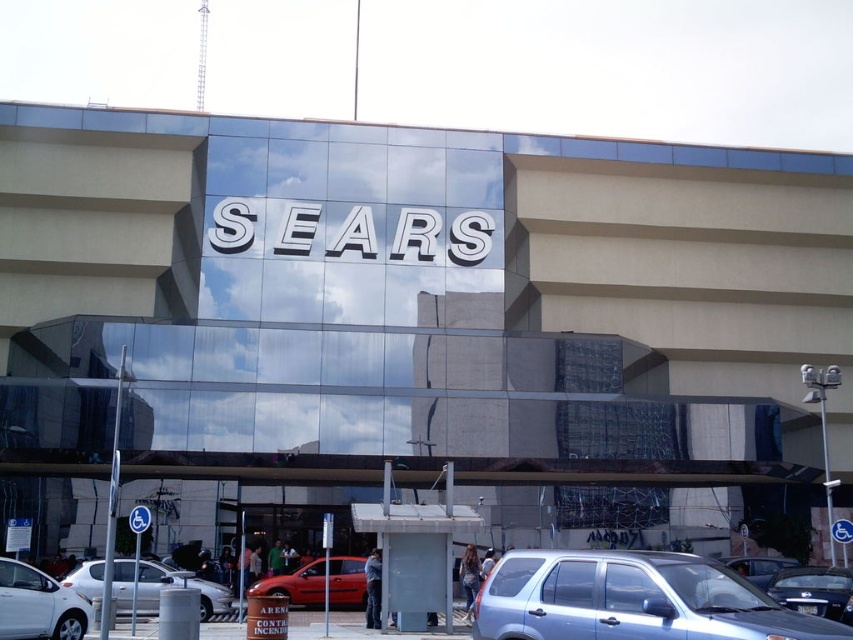
Can you confirm if silver metallic sedan at lower left is shorter than metallic silver sedan at lower right?

No, silver metallic sedan at lower left is not shorter than metallic silver sedan at lower right.

Does silver metallic sedan at lower left have a lesser width compared to metallic silver sedan at lower right?

Incorrect, silver metallic sedan at lower left's width is not less than metallic silver sedan at lower right's.

Who is more distant from viewer, [219,592] or [808,596]?

Point [219,592]

This screenshot has width=853, height=640. Identify the location of silver metallic sedan at lower left. (178, 588).

Can you confirm if white glossy sedan at lower left is bigger than shiny red car at center?

Indeed, white glossy sedan at lower left has a larger size compared to shiny red car at center.

Does white glossy sedan at lower left appear over shiny red car at center?

Indeed, white glossy sedan at lower left is positioned over shiny red car at center.

Where is `white glossy sedan at lower left`? white glossy sedan at lower left is located at coordinates (38, 605).

Which is below, satin blue suv at lower right or metallic silver sedan at lower right?

metallic silver sedan at lower right

Is satin blue suv at lower right to the left of metallic silver sedan at lower right from the viewer's perspective?

Indeed, satin blue suv at lower right is positioned on the left side of metallic silver sedan at lower right.

Where is `satin blue suv at lower right`? The image size is (853, 640). satin blue suv at lower right is located at coordinates (631, 600).

Where is `satin blue suv at lower right`? The width and height of the screenshot is (853, 640). satin blue suv at lower right is located at coordinates (631, 600).